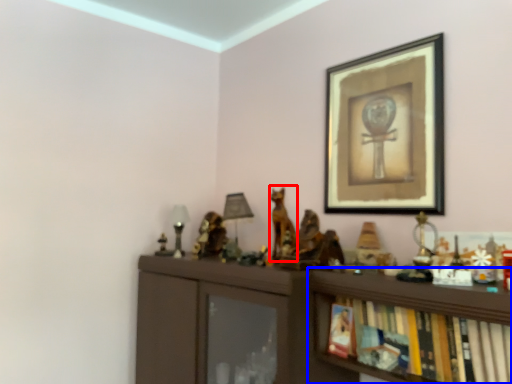
Question: Which of the following is the closest to the observer, animal (highlighted by a red box) or shelf (highlighted by a blue box)?

Choices:
 (A) animal
 (B) shelf

Answer: (B)